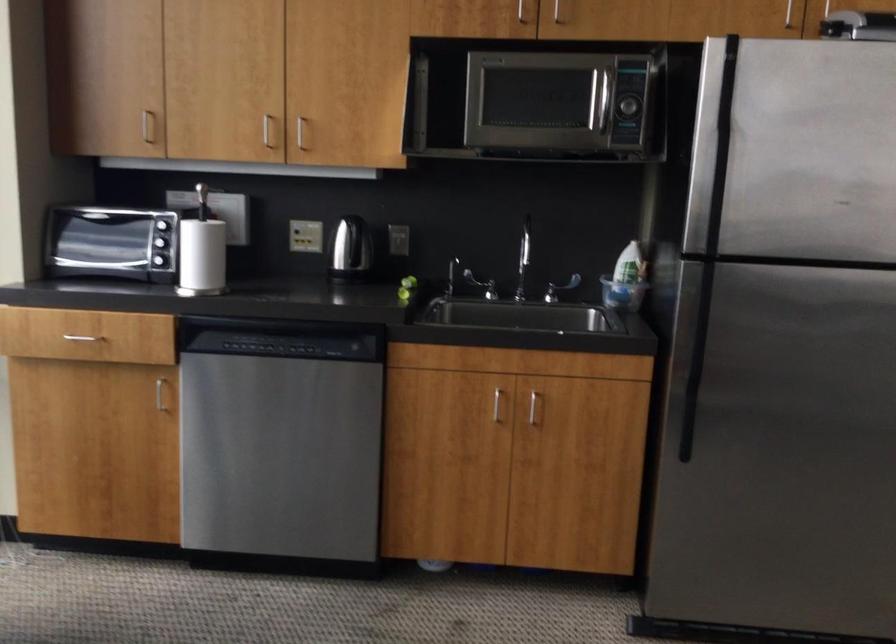
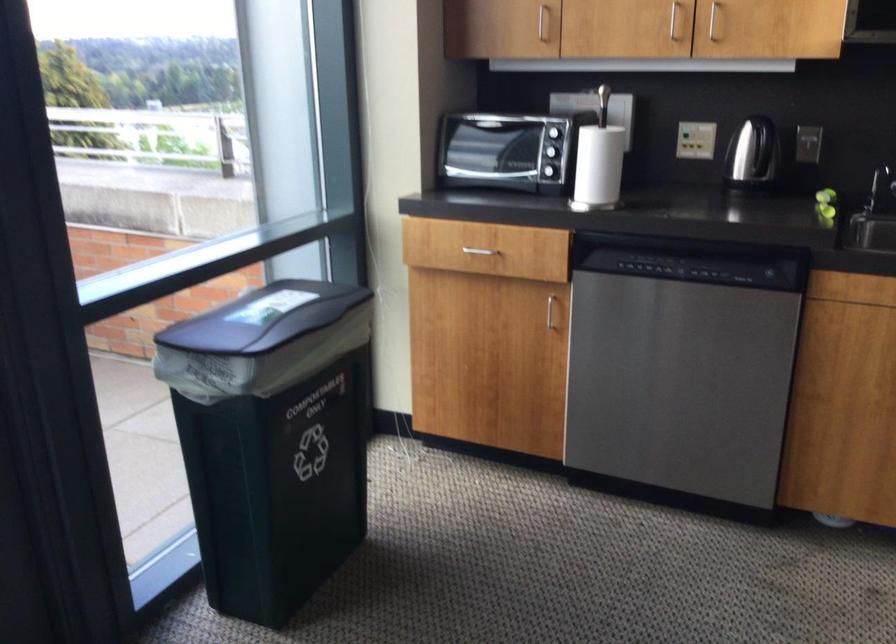
Locate, in the second image, the point that corresponds to pixel 302 238 in the first image.

(695, 140)